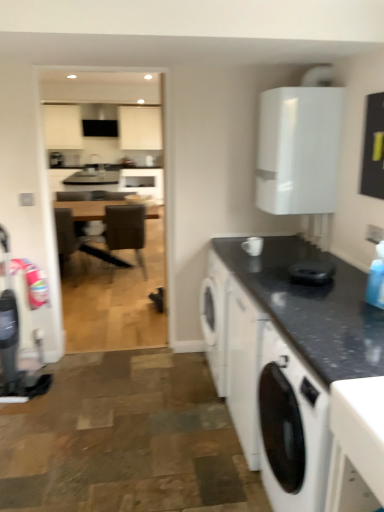
You are a GUI agent. You are given a task and a screenshot of the screen. Output one action in this format:
    pyautogui.click(x=<x>, y=<y>)
    Task: Click on the vacant area that is situated to the right of white ceramic mug at upper center, the second appliance viewed from the front
    
    Given the screenshot: What is the action you would take?
    [x=281, y=256]